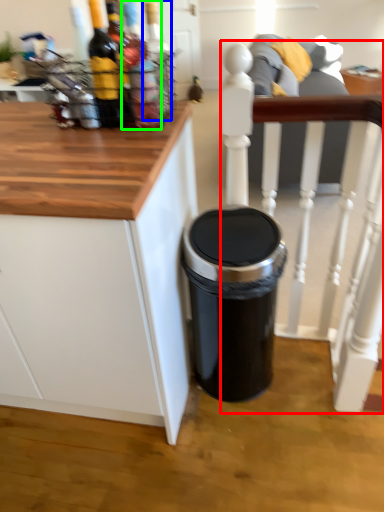
Question: Which is farther away from chair (highlighted by a red box)? bottle (highlighted by a blue box) or bottle (highlighted by a green box)?

Choices:
 (A) bottle
 (B) bottle

Answer: (A)